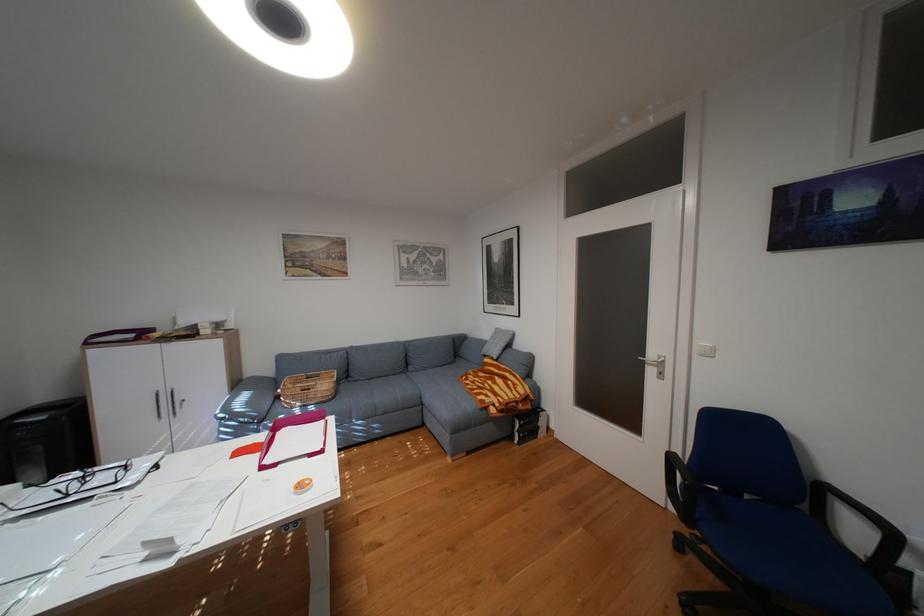
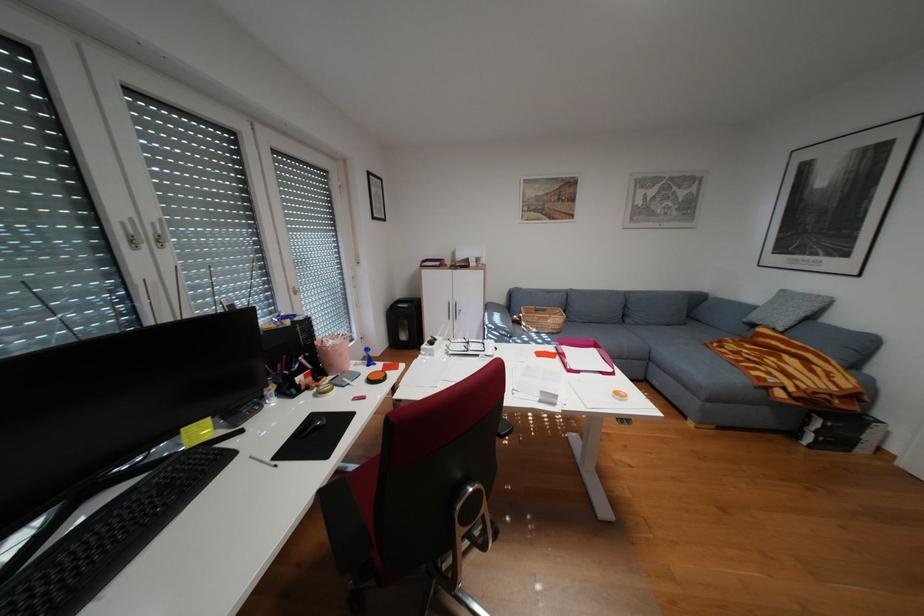
Find the pixel in the second image that matches [331,375] in the first image.

(556, 310)